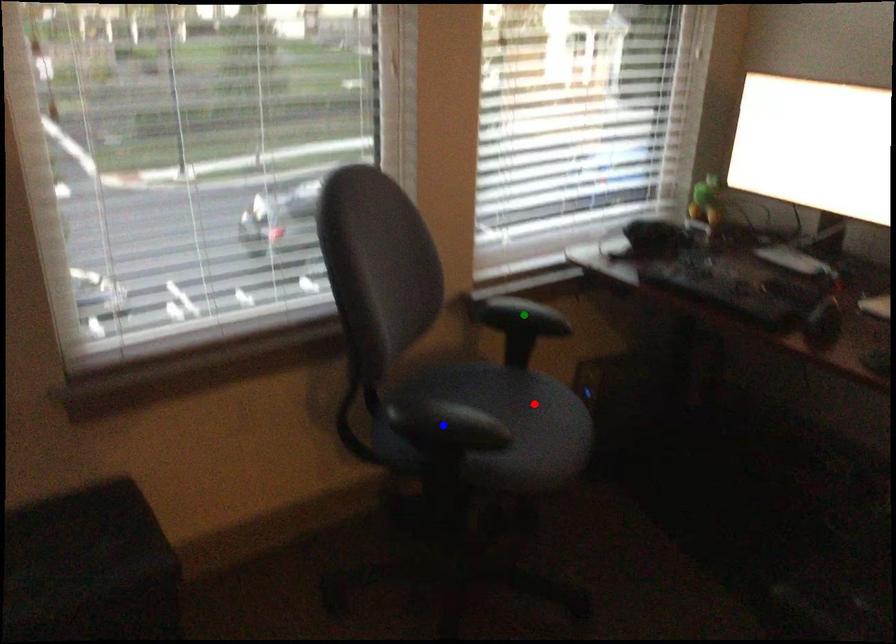
Order these from nearest to farthest:
red point
green point
blue point

green point, red point, blue point